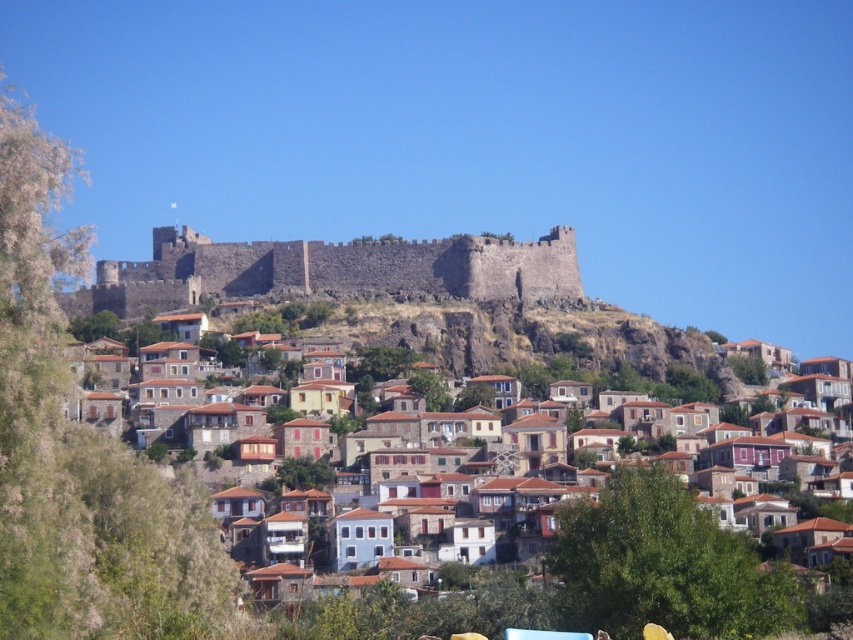
Is point (564, 365) in front of point (184, 288)?

Yes, point (564, 365) is in front of point (184, 288).

Does brown stone houses at center have a lesser height compared to dark stone wall at upper center?

No.

Between point (728, 392) and point (131, 266), which one is positioned behind?

The point (131, 266) is behind.

Locate an element on the screen. Image resolution: width=853 pixels, height=640 pixels. brown stone houses at center is located at coordinates (558, 348).